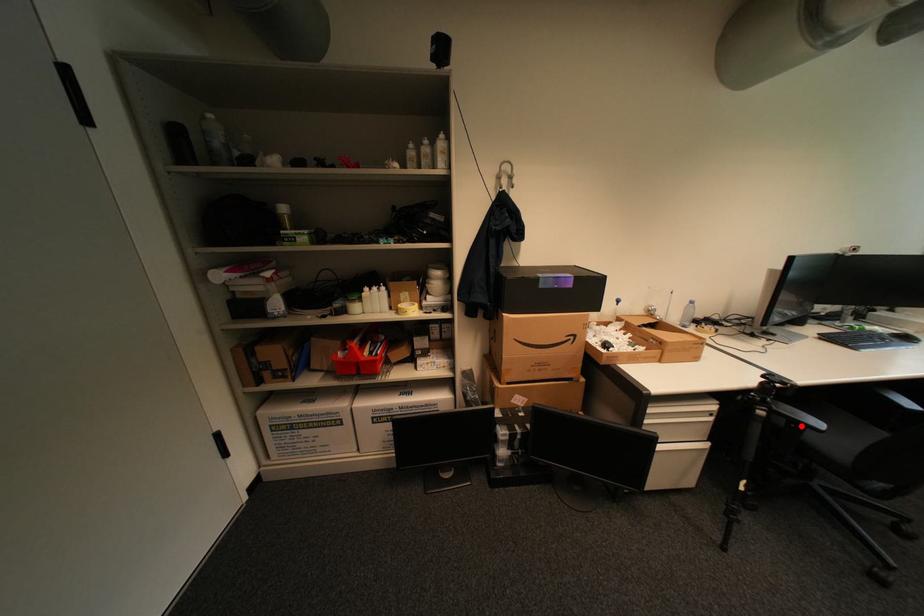
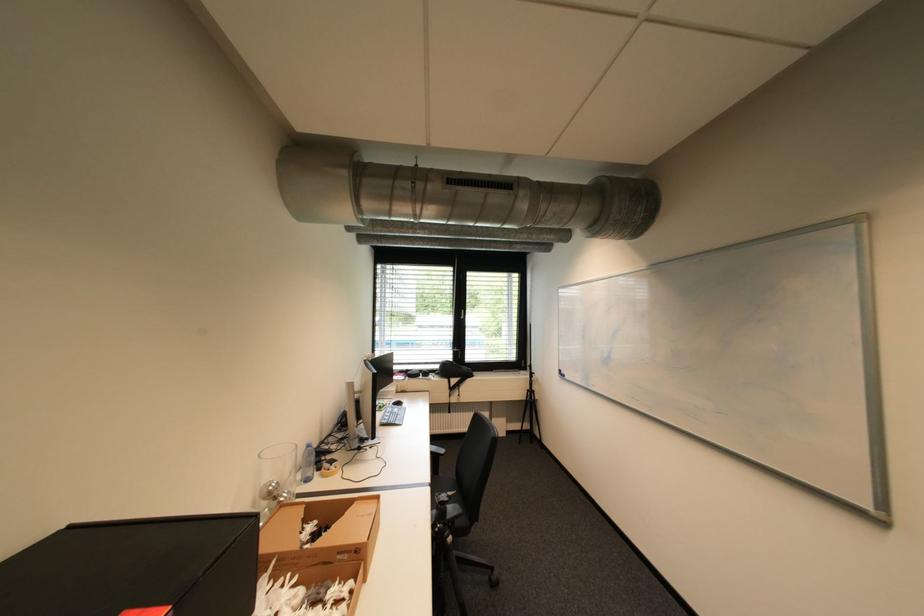
Find the pixel in the second image that matches the highlighted location in the first image.

(458, 525)